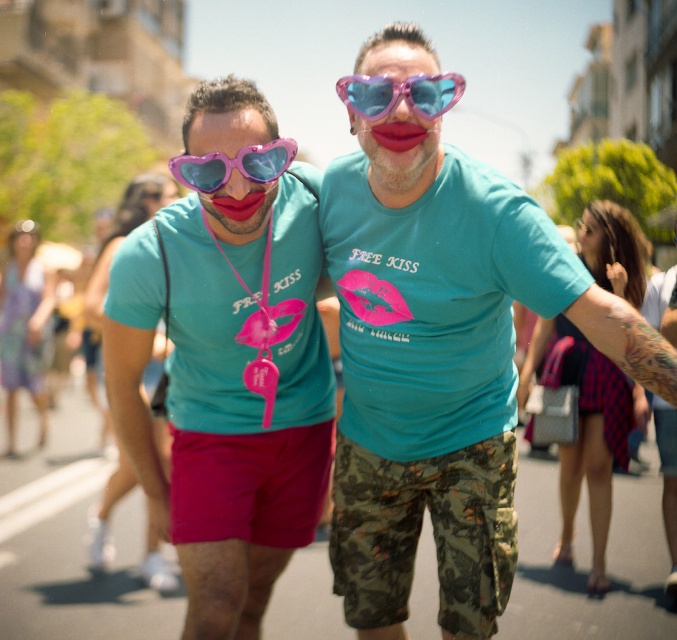
Question: Which point is farther from the camera taking this photo?

Choices:
 (A) (385, 77)
 (B) (232, 161)

Answer: (A)

Question: Which object is positioned closest to the matte pink sunglasses at center?

Choices:
 (A) pink plastic heart-shaped goggles at upper center
 (B) pink plastic heart-shaped goggles at center

Answer: (B)

Question: Does pink plastic heart-shaped goggles at upper center have a greater width compared to pink plastic heart-shaped goggles at center?

Choices:
 (A) yes
 (B) no

Answer: (B)

Question: Which object is the farthest from the pink plastic heart-shaped goggles at center?

Choices:
 (A) matte pink sunglasses at center
 (B) pink plastic heart-shaped goggles at upper center

Answer: (A)

Question: Is matte pink sunglasses at center below pink plastic heart-shaped goggles at upper center?

Choices:
 (A) no
 (B) yes

Answer: (B)

Question: Is the position of matte pink sunglasses at center more distant than that of pink plastic heart-shaped goggles at upper center?

Choices:
 (A) yes
 (B) no

Answer: (A)